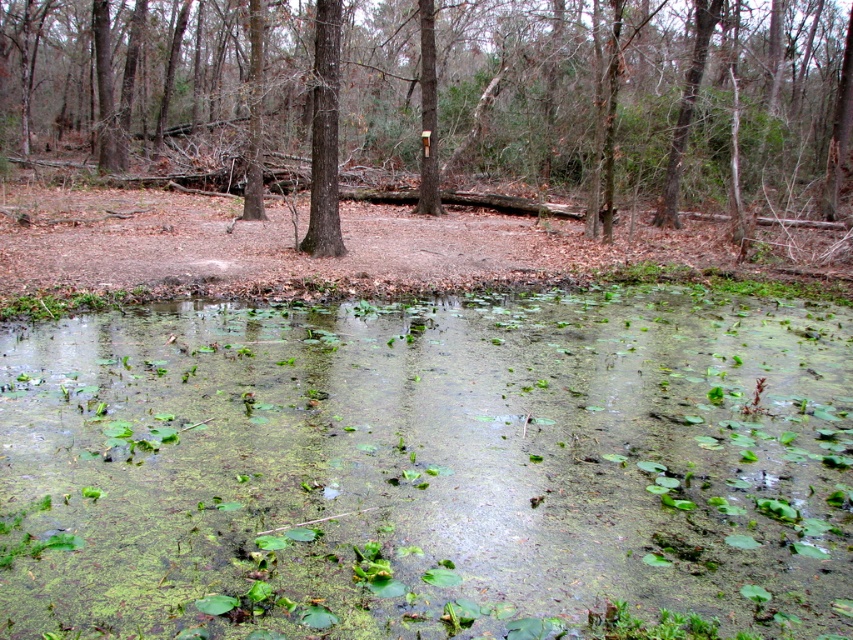
Is brown wood tree at center positioned in front of brown rough tree at center?

No, brown wood tree at center is further to the viewer.

Is point (740, 163) less distant than point (338, 236)?

No, it is behind (338, 236).

What are the coordinates of `brown wood tree at center` in the screenshot? It's located at (604, 99).

Does point (273, 428) come farther from viewer compared to point (331, 20)?

No, (273, 428) is in front of (331, 20).

Is green algae-covered water at center above brown rough tree at center?

No.

What do you see at coordinates (428, 467) in the screenshot?
I see `green algae-covered water at center` at bounding box center [428, 467].

This screenshot has width=853, height=640. Identify the location of green algae-covered water at center. (428, 467).

Find the location of `green algae-covered water at center`. green algae-covered water at center is located at coordinates (428, 467).

Does point (270, 552) lie behind point (440, 8)?

No, (270, 552) is closer to viewer.

Describe the element at coordinates (428, 467) in the screenshot. This screenshot has width=853, height=640. I see `green algae-covered water at center` at that location.

This screenshot has height=640, width=853. Identify the location of green algae-covered water at center. (428, 467).